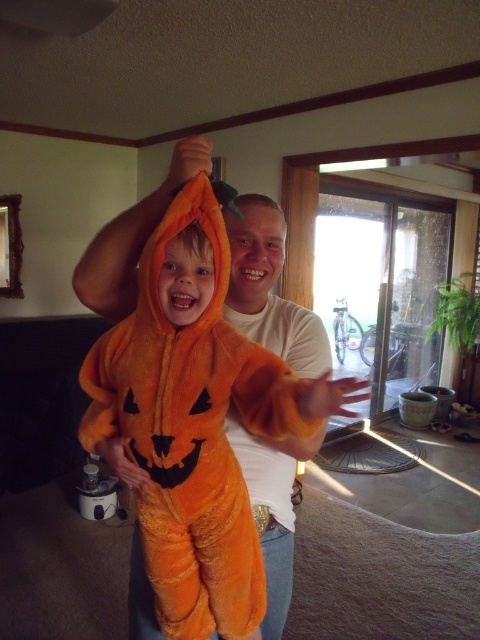
Can you confirm if velvety orange pumpkin at center is positioned above matte orange pumpkin at center?

Incorrect, velvety orange pumpkin at center is not positioned above matte orange pumpkin at center.

Who is positioned more to the left, velvety orange pumpkin at center or matte orange pumpkin at center?

Positioned to the left is velvety orange pumpkin at center.

Locate an element on the screen. The height and width of the screenshot is (640, 480). velvety orange pumpkin at center is located at coordinates (194, 420).

Find the location of a particular element. velvety orange pumpkin at center is located at coordinates (194, 420).

Between white cotton shirt at center and matte orange pumpkin at center, which one appears on the left side from the viewer's perspective?

From the viewer's perspective, matte orange pumpkin at center appears more on the left side.

Which of these two, white cotton shirt at center or matte orange pumpkin at center, stands taller?

white cotton shirt at center

Describe the element at coordinates (268, 289) in the screenshot. I see `white cotton shirt at center` at that location.

You are a GUI agent. You are given a task and a screenshot of the screen. Output one action in this format:
    pyautogui.click(x=<x>, y=<y>)
    Task: Click on the white cotton shirt at center
    This screenshot has height=640, width=480.
    Given the screenshot: What is the action you would take?
    pyautogui.click(x=268, y=289)

Can you confirm if velvety orange pumpkin at center is positioned below white cotton shirt at center?

No.

Looking at this image, does velvety orange pumpkin at center have a greater width compared to white cotton shirt at center?

In fact, velvety orange pumpkin at center might be narrower than white cotton shirt at center.

Who is more forward, (159, 376) or (247, 278)?

Point (159, 376) is more forward.

Image resolution: width=480 pixels, height=640 pixels. Identify the location of velvety orange pumpkin at center. (194, 420).